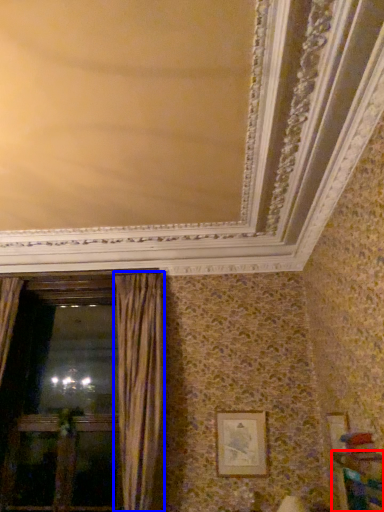
Question: Which object appears closest to the camera in this image, furniture (highlighted by a red box) or curtain (highlighted by a blue box)?

Choices:
 (A) furniture
 (B) curtain

Answer: (A)